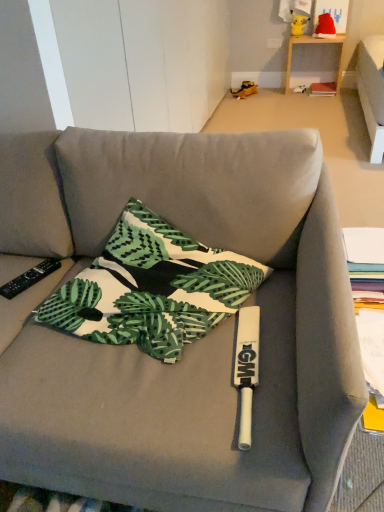
The height and width of the screenshot is (512, 384). What are the coordinates of `free space on the front side of yellow plush toy at upper center, the 1th toy when ordered from left to right` in the screenshot? It's located at (306, 34).